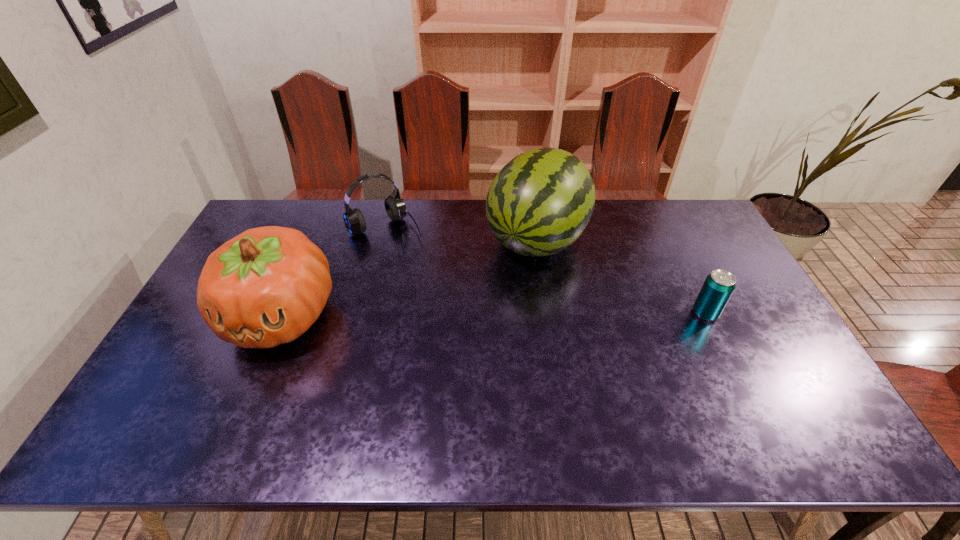
Identify the location of free spot on the desktop that is between the pumpkin and the rightmost object and is positioned on the ear cushions of the headset. The width and height of the screenshot is (960, 540). (455, 314).

The height and width of the screenshot is (540, 960). Find the location of `vacant space on the desktop that is between the pumpkin and the shortest object and is positioned at the stem end of the watermelon`. vacant space on the desktop that is between the pumpkin and the shortest object and is positioned at the stem end of the watermelon is located at coordinates click(x=479, y=314).